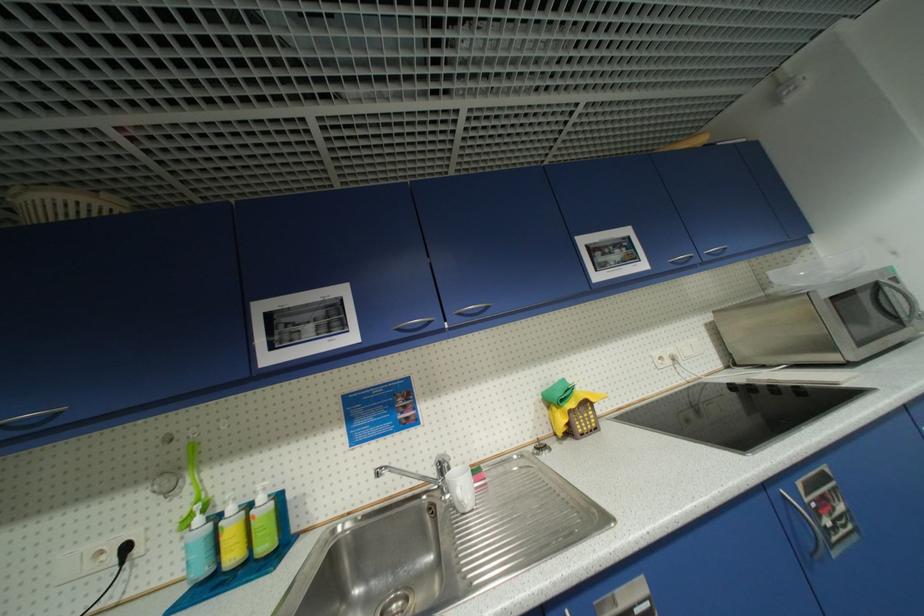
This screenshot has width=924, height=616. I want to click on blue dispenser pump, so click(x=193, y=514).